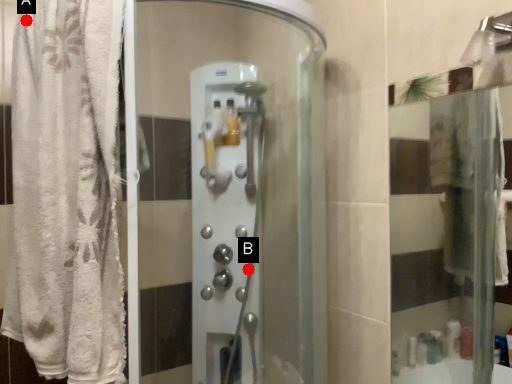
Question: Two points are circled on the image, labeled by A and B beside each circle. Which point is farther from the camera taking this photo?

Choices:
 (A) A is further
 (B) B is further

Answer: (B)